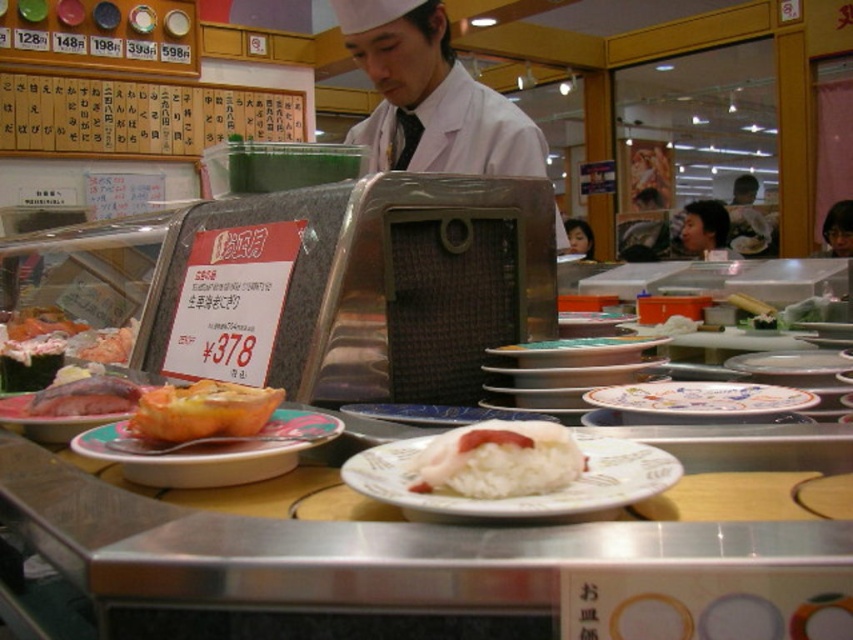
Is white rice at center wider than pinkish salmon at left?

In fact, white rice at center might be narrower than pinkish salmon at left.

Is point (416, 468) farther from viewer compared to point (44, 397)?

That is False.

This screenshot has width=853, height=640. I want to click on white rice at center, so (498, 460).

Is white glossy rice at center smaller than pinkish salmon at left?

Yes.

Does white glossy rice at center have a lesser width compared to pinkish salmon at left?

No.

This screenshot has height=640, width=853. I want to click on white glossy rice at center, so click(519, 497).

Who is positioned more to the right, matte ceramic plate at center or white glossy plate at center?

From the viewer's perspective, white glossy plate at center appears more on the right side.

Find the location of a particular element. The image size is (853, 640). matte ceramic plate at center is located at coordinates [x=212, y=438].

I want to click on matte ceramic plate at center, so click(x=212, y=438).